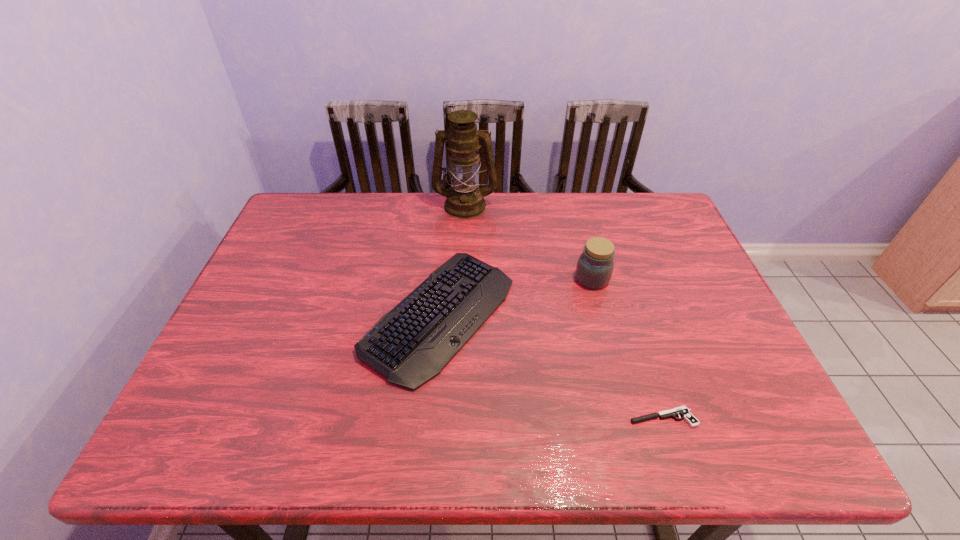
You are a GUI agent. You are given a task and a screenshot of the screen. Output one action in this format:
    pyautogui.click(x=<x>, y=<y>)
    Task: Click on the free region located on the front-facing side of the pistol
    The image size is (960, 540).
    Given the screenshot: What is the action you would take?
    pyautogui.click(x=487, y=417)

Identify the location of vacant area located 0.140m on the front-facing side of the pistol. This screenshot has width=960, height=540. (563, 417).

At what (x,y) coordinates should I click in order to perform the action: click on object situated at the far edge. Please return your answer as a coordinate pair (x, y). This screenshot has height=540, width=960. Looking at the image, I should click on (464, 200).

At what (x,y) coordinates should I click in order to perform the action: click on object that is at the near edge. Please return your answer as a coordinate pair (x, y). Looking at the image, I should click on (685, 413).

In the image, there is a desktop. Identify the location of vacant space at the far edge. (385, 201).

Locate an element on the screen. This screenshot has width=960, height=540. vacant space at the near edge is located at coordinates (506, 435).

The width and height of the screenshot is (960, 540). I want to click on vacant space at the left edge, so click(253, 321).

Identify the location of blank space at the right edge of the desktop. (654, 289).

In the image, there is a desktop. Identify the location of vacant region at the far left corner. The width and height of the screenshot is (960, 540). (306, 196).

Locate an element on the screen. Image resolution: width=960 pixels, height=540 pixels. vacant point located between the shortest object and the third shortest object is located at coordinates (627, 348).